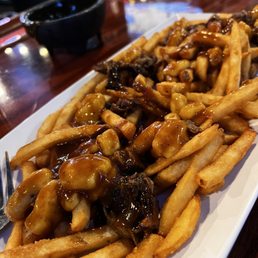
You are a GUI agent. You are given a task and a screenshot of the screen. Output one action in this format:
    pyautogui.click(x=<x>, y=<y>)
    Task: Click on the floor
    This screenshot has width=258, height=258.
    Given the screenshot: What is the action you would take?
    pyautogui.click(x=16, y=12)